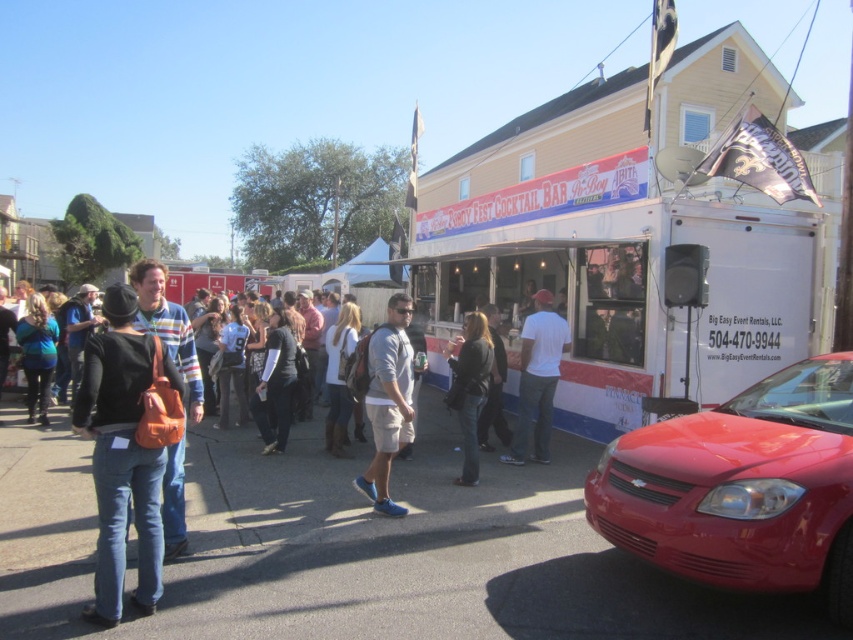
Question: Can you confirm if shiny red sedan at lower right is wider than blue denim jeans at lower left?

Choices:
 (A) no
 (B) yes

Answer: (B)

Question: Which point is farther to the camera?

Choices:
 (A) (492, 368)
 (B) (44, 424)
 (C) (389, 369)

Answer: (B)

Question: Can you confirm if white/red/blue painted trailer at center is thinner than shiny red sedan at lower right?

Choices:
 (A) no
 (B) yes

Answer: (A)

Question: Is dark gray sweater at center in front of dark gray fabric jacket at center?

Choices:
 (A) no
 (B) yes

Answer: (B)

Question: Which point is farther from the camera taking this photo?

Choices:
 (A) (10, 324)
 (B) (126, 432)

Answer: (A)

Question: Estimate the real-world distances between objects in this image. Which object is closer to the dark gray fabric jacket at center?

Choices:
 (A) matte orange bag at center
 (B) matte gray shirt at center
 (C) shiny red sedan at lower right
 (D) denim jeans at center

Answer: (B)